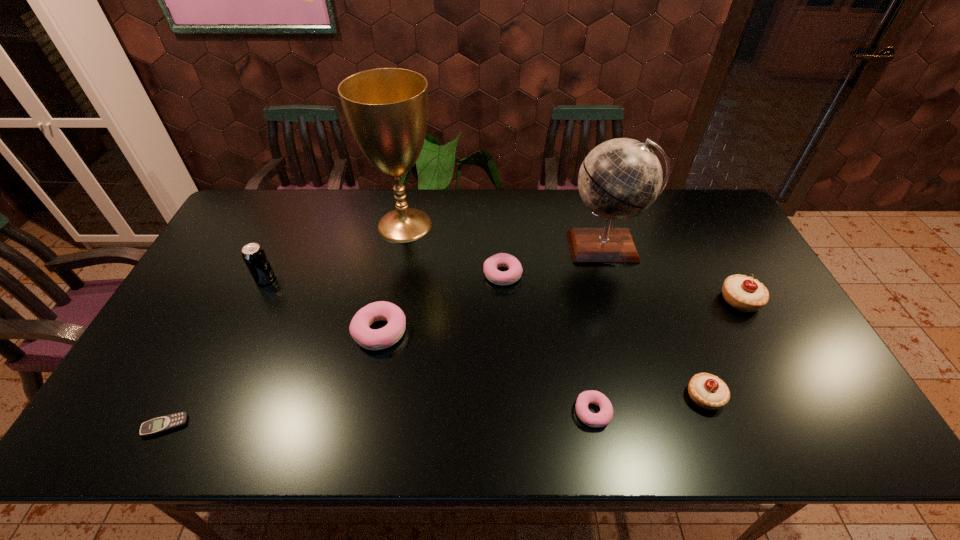
Find the location of `blank space that satisfies the following two spatial constraints: 1. on the back side of the bigger beige pastry; 2. on the left side of the biggest pink pastry`. blank space that satisfies the following two spatial constraints: 1. on the back side of the bigger beige pastry; 2. on the left side of the biggest pink pastry is located at coordinates (386, 300).